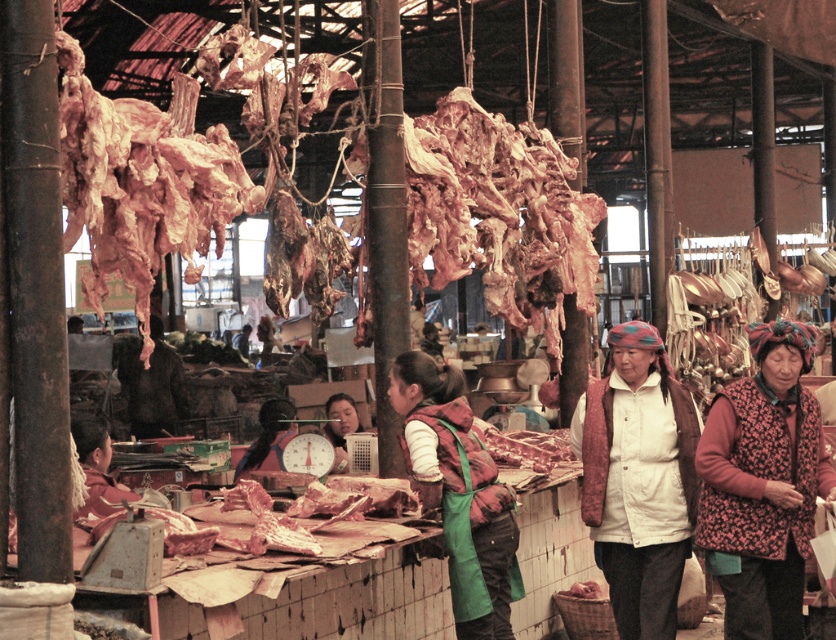
Does floral-patterned vest at lower right have a larger size compared to matte pink apron at center?

Yes.

Which of these two, floral-patterned vest at lower right or matte pink apron at center, stands shorter?

Standing shorter between the two is matte pink apron at center.

Which is in front, point (778, 435) or point (347, 426)?

Point (778, 435) is in front.

The width and height of the screenshot is (836, 640). I want to click on floral-patterned vest at lower right, so click(763, 484).

Between point (796, 353) and point (388, 390), which one is positioned in front?

Positioned in front is point (796, 353).

Between floral-patterned vest at lower right and green apron at center, which one is positioned lower?

floral-patterned vest at lower right is below.

Find the location of `floral-patterned vest at lower right`. floral-patterned vest at lower right is located at coordinates (763, 484).

What are the coordinates of `floral-patterned vest at lower right` in the screenshot? It's located at (763, 484).

Is green apron at center thinner than matte pink apron at center?

Incorrect, green apron at center's width is not less than matte pink apron at center's.

Is green apron at center closer to the viewer compared to matte pink apron at center?

That is True.

Is point (465, 432) positioned in front of point (343, 442)?

Yes, point (465, 432) is in front of point (343, 442).

At what (x,y) coordinates should I click in order to perform the action: click on green apron at center. Please return your answer as a coordinate pair (x, y). The image size is (836, 640). Looking at the image, I should click on (459, 493).